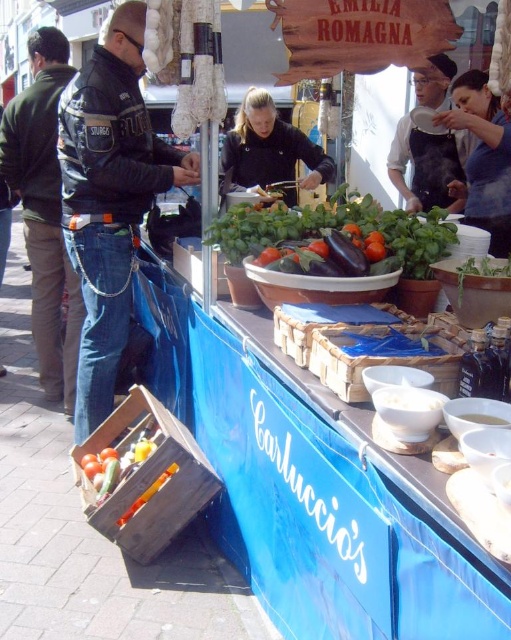
Does blue fabric at upper right have a lesser height compared to black apron at upper right?

No.

Which of these two, blue fabric at upper right or black apron at upper right, stands taller?

Standing taller between the two is blue fabric at upper right.

At what (x,y) coordinates should I click in order to perform the action: click on blue fabric at upper right. Please return your answer as a coordinate pair (x, y). Looking at the image, I should click on (482, 157).

Who is higher up, green matte jacket at left or green matte eggplant at center?

green matte jacket at left is above.

Which is behind, point (55, 291) or point (227, 234)?

The point (55, 291) is behind.

The width and height of the screenshot is (511, 640). I want to click on green matte jacket at left, so click(x=44, y=211).

I want to click on green matte jacket at left, so click(44, 211).

In the scene shown: Who is lower down, black leather jacket at left or black apron at upper right?

Positioned lower is black leather jacket at left.

Who is higher up, black leather jacket at left or black apron at upper right?

A: black apron at upper right

Which is behind, point (99, 250) or point (444, 76)?

The point (444, 76) is behind.

This screenshot has height=640, width=511. In order to click on black leather jacket at left in this screenshot , I will do `click(109, 196)`.